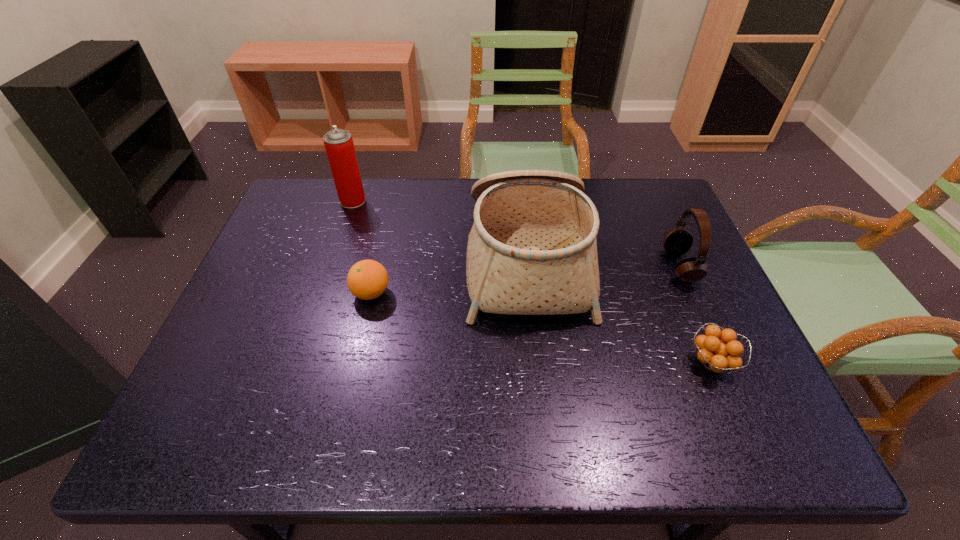
Identify the location of the leftmost object. The width and height of the screenshot is (960, 540). (339, 146).

At what (x,y) coordinates should I click in order to perform the action: click on the third object from left to right. Please return your answer as a coordinate pair (x, y). The image size is (960, 540). Looking at the image, I should click on point(532,250).

Where is `headset`? This screenshot has height=540, width=960. headset is located at coordinates (678, 241).

The image size is (960, 540). In order to click on the left orange fruit in this screenshot , I will do `click(367, 279)`.

Locate an element on the screen. The height and width of the screenshot is (540, 960). the farther orange fruit is located at coordinates coord(367,279).

Locate an element on the screen. This screenshot has height=540, width=960. the nearer orange fruit is located at coordinates (714, 355).

Locate an element on the screen. the right orange fruit is located at coordinates (714, 355).

Locate an element on the screen. vacant space located 0.280m on the front of the leftmost object is located at coordinates (328, 274).

The height and width of the screenshot is (540, 960). What are the coordinates of `vacant space situated 0.380m with the lid open on the basket` in the screenshot? It's located at (325, 260).

Image resolution: width=960 pixels, height=540 pixels. Find the location of `vacant space located 0.300m with the lid open on the basket`. vacant space located 0.300m with the lid open on the basket is located at coordinates (355, 260).